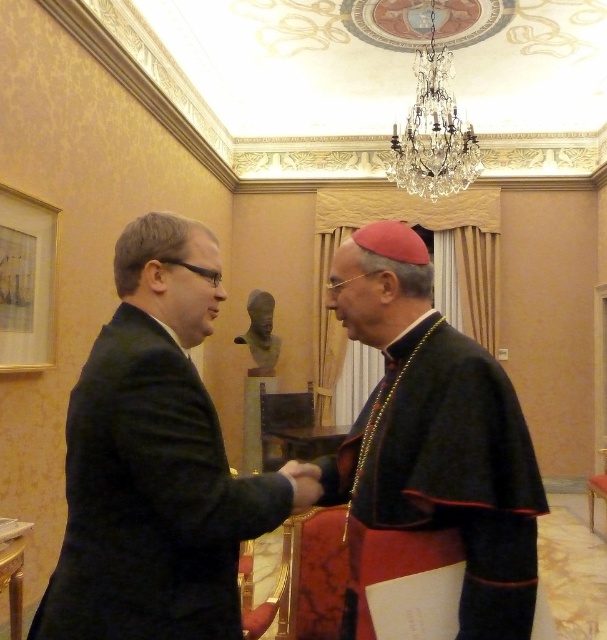
You are a tailor measuring robes for a historical reenactment. You have two robes in front of you, the black velvet robe at center and the velvet black robe at left. Which robe should you choose if you need to fit a larger individual?

The black velvet robe at center has a larger size compared to the velvet black robe at left, so it is suitable for a larger individual.

You are an interior designer observing the scene. You need to hang a large painting that requires a sturdy hook. Given the spatial arrangement of the black velvet robe at center and the velvet black robe at left, which robe is positioned closer to the ceiling where the hook is installed?

The black velvet robe at center is taller than the velvet black robe at left, so it is closer to the ceiling. Therefore, the hook should be placed near the black velvet robe at center.